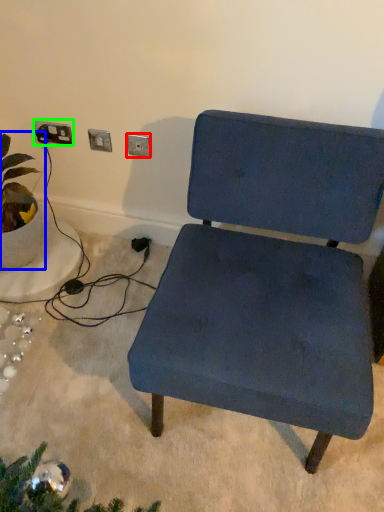
Question: Which is nearer to the electric outlet (highlighted by a red box)? houseplant (highlighted by a blue box) or electric outlet (highlighted by a green box).

Choices:
 (A) houseplant
 (B) electric outlet

Answer: (B)